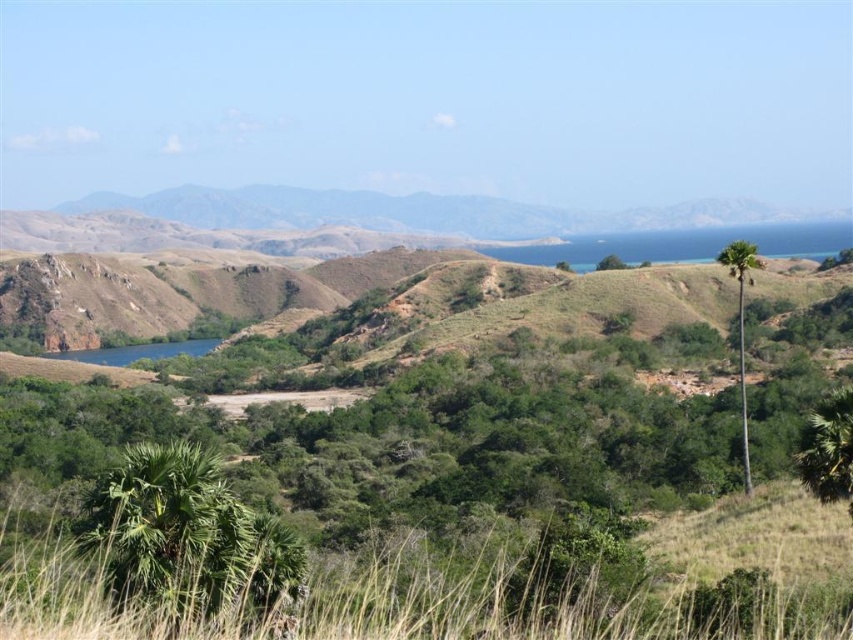
How distant is green leafy palm tree at right from green leafy tree at center?

green leafy palm tree at right and green leafy tree at center are 392.45 feet apart from each other.

Is green leafy palm tree at right to the right of green leafy tree at center from the viewer's perspective?

Incorrect, green leafy palm tree at right is not on the right side of green leafy tree at center.

Which is behind, point (741, 372) or point (608, 259)?

Positioned behind is point (608, 259).

Locate an element on the screen. green leafy palm tree at right is located at coordinates (741, 326).